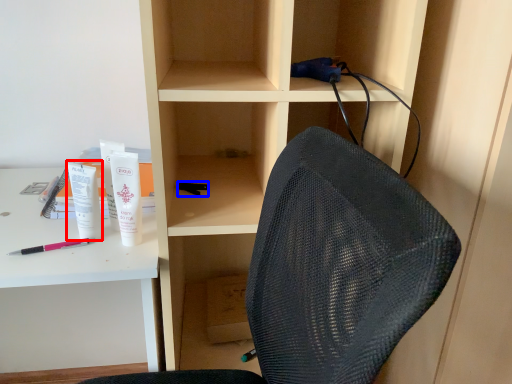
Question: Which object is further to the camera taking this photo, stationery (highlighted by a red box) or stationery (highlighted by a blue box)?

Choices:
 (A) stationery
 (B) stationery

Answer: (B)